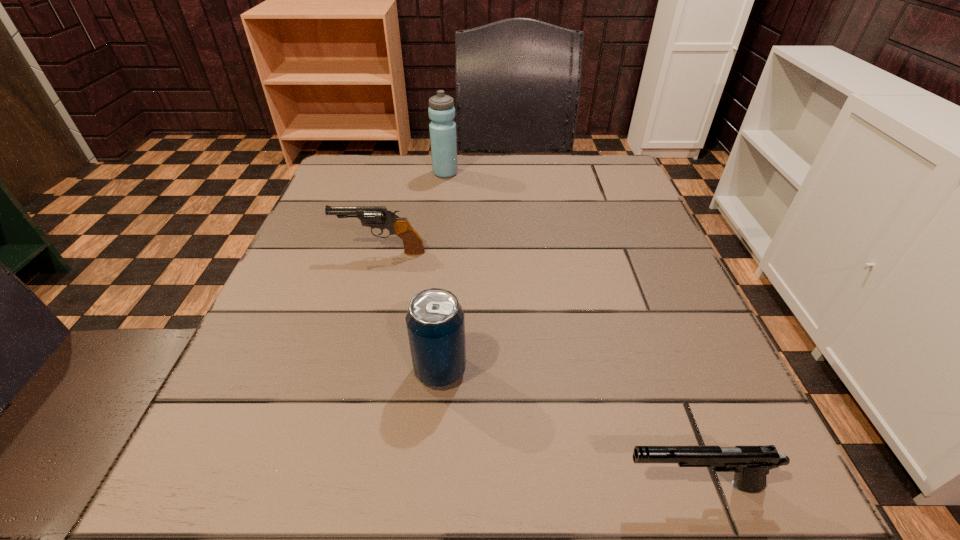
This screenshot has width=960, height=540. I want to click on empty space that is in between the farthest object and the second tallest object, so click(443, 272).

What are the coordinates of `free space between the third nearest object and the farthest object` in the screenshot? It's located at (413, 213).

Where is `empty location between the third shortest object and the right gun`? empty location between the third shortest object and the right gun is located at coordinates (566, 428).

Locate an element on the screen. vacant space in between the nearest object and the soda can is located at coordinates (566, 428).

Select which object is the third closest to the right gun. Please provide its 2D coordinates. Your answer should be formatted as a tuple, i.e. [(x, y)], where the tuple contains the x and y coordinates of a point satisfying the conditions above.

[(441, 111)]

Point out which object is positioned as the second nearest to the third shortest object. Please provide its 2D coordinates. Your answer should be formatted as a tuple, i.e. [(x, y)], where the tuple contains the x and y coordinates of a point satisfying the conditions above.

[(379, 217)]

The width and height of the screenshot is (960, 540). Find the location of `free region that satisfies the following two spatial constraints: 1. on the front side of the water bottle; 2. on the right side of the second tallest object`. free region that satisfies the following two spatial constraints: 1. on the front side of the water bottle; 2. on the right side of the second tallest object is located at coordinates (422, 370).

Identify the location of free location that satisfies the following two spatial constraints: 1. along the barrel of the third nearest object; 2. on the back side of the farthest object. (402, 173).

Identify the location of blank area in the image that satisfies the following two spatial constraints: 1. along the barrel of the farthest object; 2. on the left side of the farther gun. The image size is (960, 540). (402, 173).